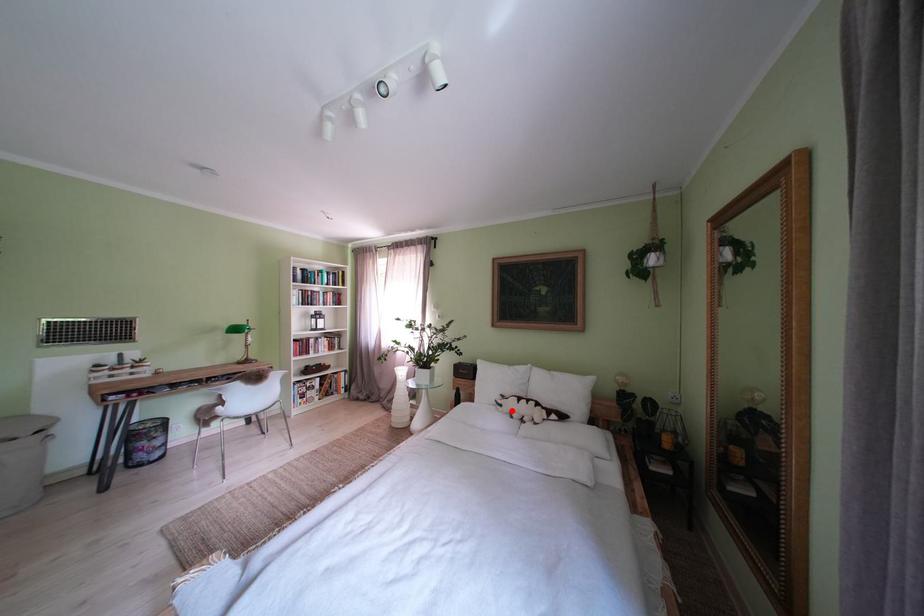
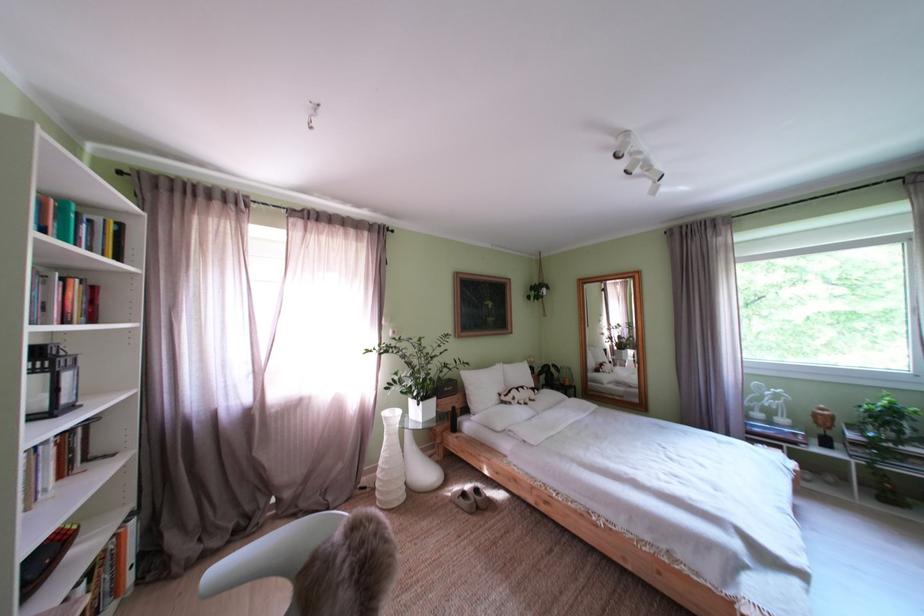
Find the pixel in the second image that matches the highlighted location in the first image.

(525, 405)